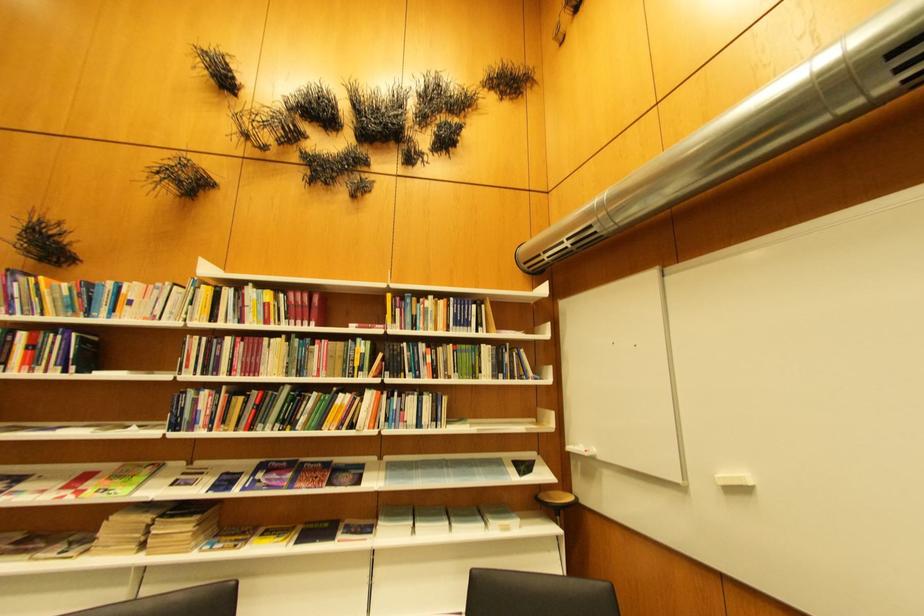
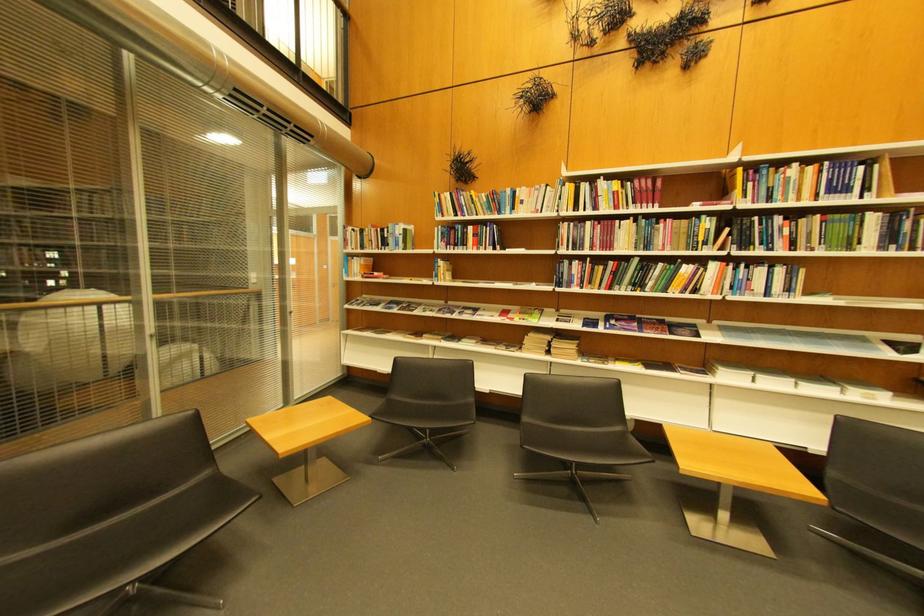
In the second image, find the point that corresponds to (301,296) in the first image.

(648, 183)